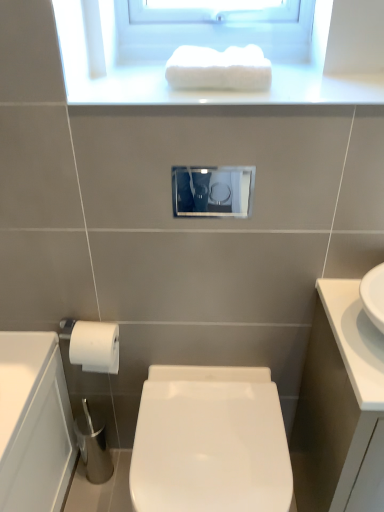
Question: Which is correct: white fluffy towel at upper center is inside white glossy toilet at center, or outside of it?

Choices:
 (A) outside
 (B) inside

Answer: (A)

Question: From a real-world perspective, is white fluffy towel at upper center physically located above or below white glossy toilet at center?

Choices:
 (A) above
 (B) below

Answer: (A)

Question: Which is farther from the white glossy cabinet at right?

Choices:
 (A) white glossy towel at upper center
 (B) white fluffy towel at upper center
 (C) matte glass medicine cabinet at center
 (D) white glossy toilet at center

Answer: (C)

Question: Based on their relative distances, which object is farther from the white fluffy towel at upper center?

Choices:
 (A) white glossy toilet at center
 (B) matte glass medicine cabinet at center
 (C) white glossy towel at upper center
 (D) white glossy cabinet at right

Answer: (B)